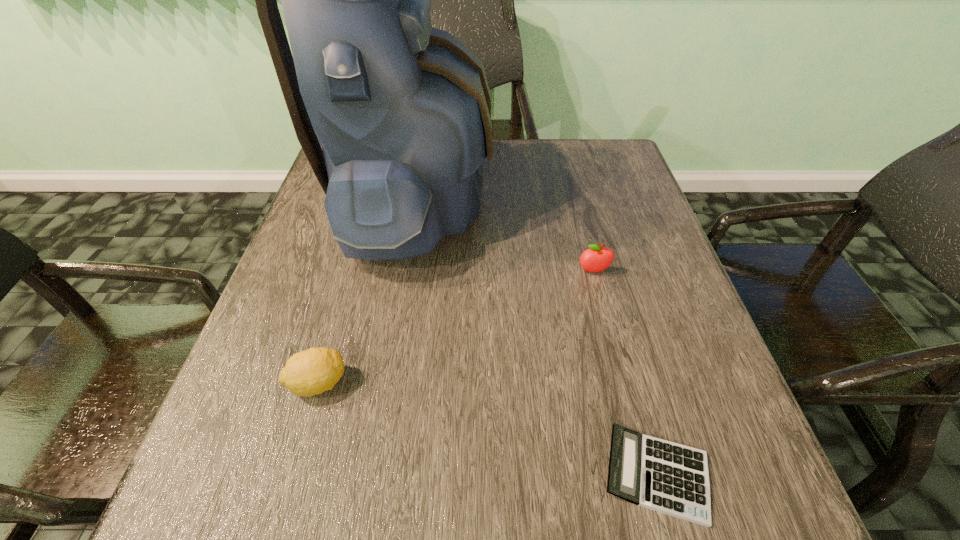
The image size is (960, 540). What are the coordinates of `object at the near edge` in the screenshot? It's located at (664, 476).

What are the coordinates of `backpack that is at the left edge` in the screenshot? It's located at (402, 110).

Locate an element on the screen. This screenshot has height=540, width=960. lemon positioned at the left edge is located at coordinates (307, 373).

The width and height of the screenshot is (960, 540). What are the coordinates of `apple that is at the right edge` in the screenshot? It's located at (596, 259).

The width and height of the screenshot is (960, 540). Find the location of `calculator situated at the right edge`. calculator situated at the right edge is located at coordinates (664, 476).

Find the location of a particular element. Image resolution: width=960 pixels, height=540 pixels. object that is at the far left corner is located at coordinates (402, 110).

You are a GUI agent. You are given a task and a screenshot of the screen. Output one action in this format:
    pyautogui.click(x=<x>, y=<y>)
    Task: Click on the object at the near right corner
    The width and height of the screenshot is (960, 540).
    Given the screenshot: What is the action you would take?
    pyautogui.click(x=664, y=476)

Where is `vacant space at the far edge`? The width and height of the screenshot is (960, 540). vacant space at the far edge is located at coordinates (525, 183).

Where is `vacant space at the near edge of the desktop`? The height and width of the screenshot is (540, 960). vacant space at the near edge of the desktop is located at coordinates (510, 488).

Image resolution: width=960 pixels, height=540 pixels. I want to click on vacant space at the left edge, so click(x=354, y=271).